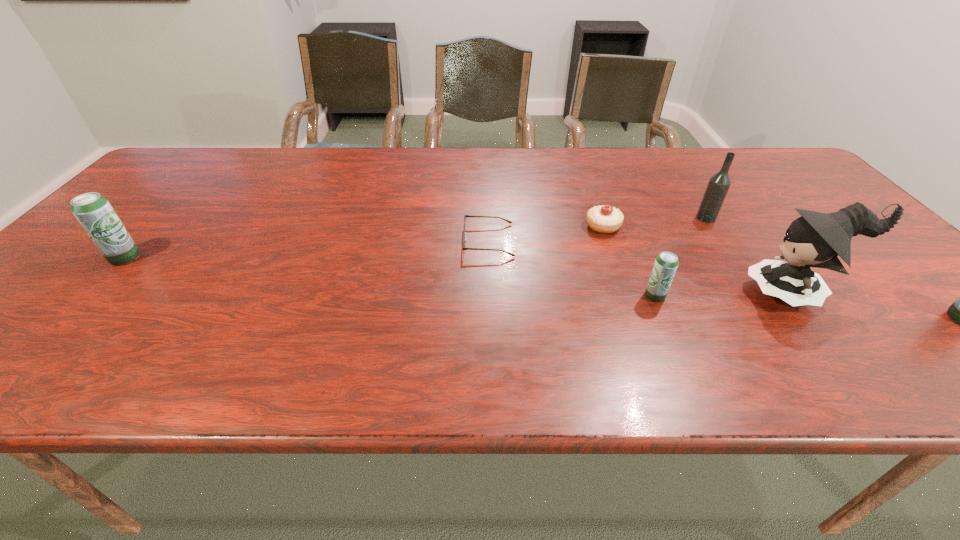
To achieve uniform spacing by inserting another beer_can among them, please point to a free space for this new beer_can. Please provide its 2D coordinates. Your answer should be formatted as a tuple, i.e. [(x, y)], where the tuple contains the x and y coordinates of a point satisfying the conditions above.

[(377, 276)]